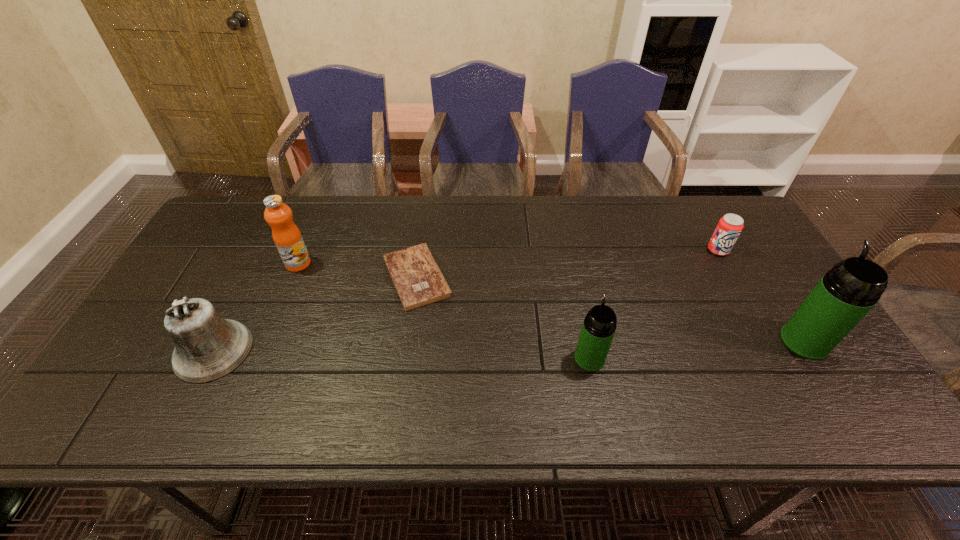
Where is `thermos bottle located at the near edge`? Image resolution: width=960 pixels, height=540 pixels. thermos bottle located at the near edge is located at coordinates (599, 326).

Locate an element on the screen. The width and height of the screenshot is (960, 540). bell located at the near edge is located at coordinates (207, 347).

Locate an element on the screen. object that is at the left edge is located at coordinates (207, 347).

Find the location of a particular element. thermos bottle present at the right edge is located at coordinates (846, 293).

This screenshot has height=540, width=960. I want to click on soda can that is at the right edge, so click(x=730, y=226).

Where is `object situated at the near left corner`? object situated at the near left corner is located at coordinates (207, 347).

Locate an element on the screen. vacant region at the far edge of the desktop is located at coordinates (615, 239).

This screenshot has height=540, width=960. In order to click on free space at the near edge in this screenshot , I will do `click(309, 364)`.

Locate an element on the screen. The width and height of the screenshot is (960, 540). free space at the left edge is located at coordinates (183, 278).

Locate an element on the screen. free space at the right edge is located at coordinates (760, 314).